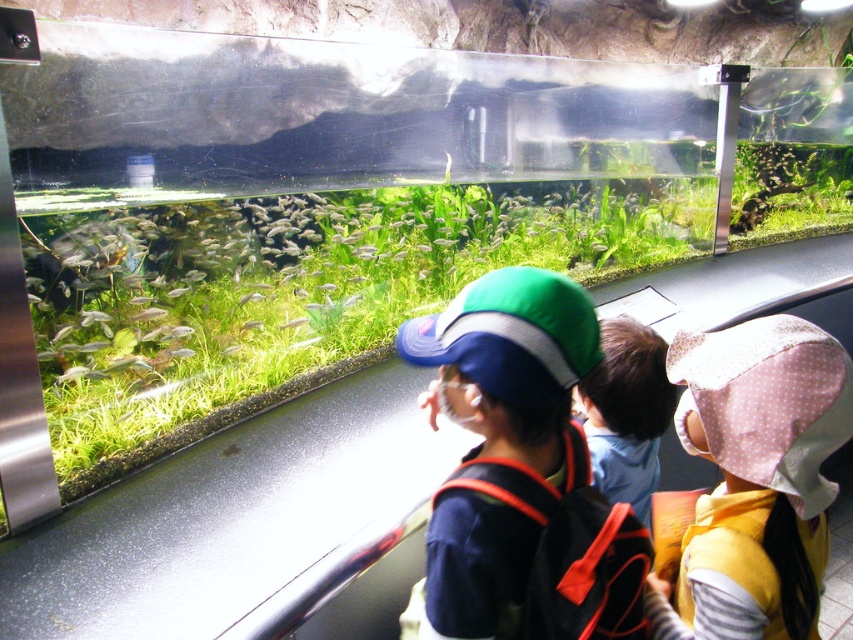
Consider the image. You are a parent trying to locate your child who is wearing a matte blue cap at center near a translucent glass fish at center in the aquarium. Which object is closer to the front of the scene?

The matte blue cap at center is much taller as translucent glass fish at center, so the matte blue cap at center is closer to the front of the scene.

You are a parent trying to take a photo of your child with the blue fabric cap at center and the translucent glass fish at center in the aquarium. Can you fit both objects in the frame without moving your position?

The blue fabric cap at center is taller than the translucent glass fish at center, so it is possible to fit both in the frame as long as the camera can capture the height of the taller object.

Looking at this image, you are a parent trying to locate your child in the aquarium. You see the blue fabric cap at center and the translucent glass fish at center. Which one is closer to the front of the aquarium?

The blue fabric cap at center is positioned under the translucent glass fish at center, so the translucent glass fish at center is closer to the front of the aquarium.